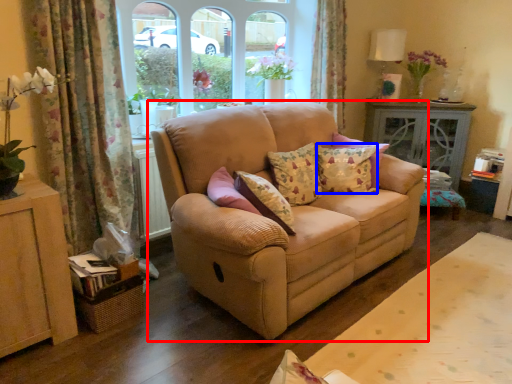
Question: Which object is closer to the camera taking this photo, studio couch (highlighted by a red box) or pillow (highlighted by a blue box)?

Choices:
 (A) studio couch
 (B) pillow

Answer: (A)